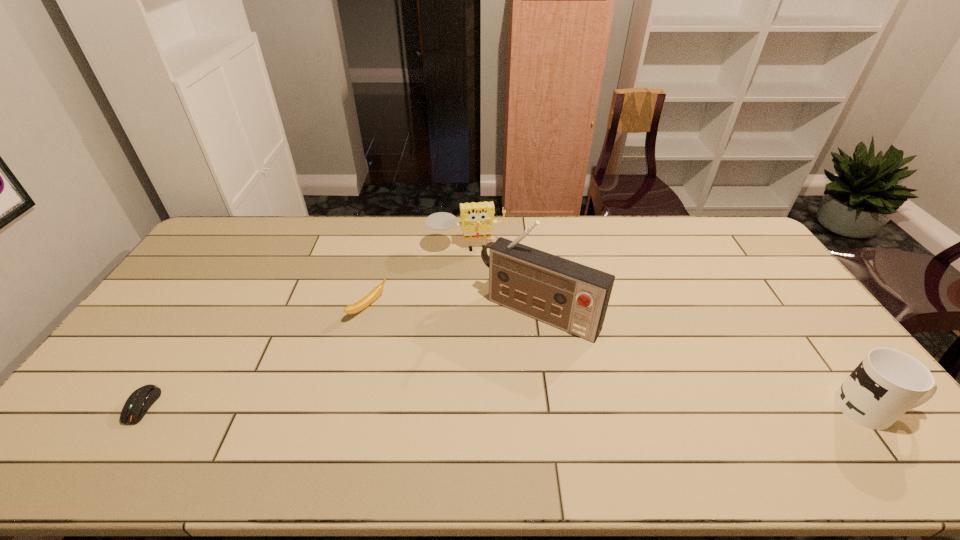
This screenshot has height=540, width=960. Identify the location of object that is at the right edge. (887, 383).

This screenshot has width=960, height=540. In order to click on object that is at the near left corner in this screenshot , I will do (139, 402).

What are the coordinates of `object positioned at the near right corner` in the screenshot? It's located at (887, 383).

The height and width of the screenshot is (540, 960). In the image, there is a desktop. Find the location of `free space at the far edge`. free space at the far edge is located at coordinates (259, 230).

Where is `free space at the near edge of the desktop`? This screenshot has width=960, height=540. free space at the near edge of the desktop is located at coordinates (698, 397).

Where is `vacant region at the left edge of the desktop`? The width and height of the screenshot is (960, 540). vacant region at the left edge of the desktop is located at coordinates (168, 291).

Locate an element on the screen. Image resolution: width=960 pixels, height=540 pixels. vacant area at the right edge of the desktop is located at coordinates (784, 303).

At what (x,y) coordinates should I click in order to perform the action: click on vacant space that's between the fourth tallest object and the radio receiver. Please return your answer as a coordinate pair (x, y). Image resolution: width=960 pixels, height=540 pixels. Looking at the image, I should click on (454, 311).

Locate an element on the screen. This screenshot has width=960, height=540. free space between the mug and the second object from left to right is located at coordinates (620, 358).

Where is `free space between the farthest object and the banana`? This screenshot has height=540, width=960. free space between the farthest object and the banana is located at coordinates (418, 279).